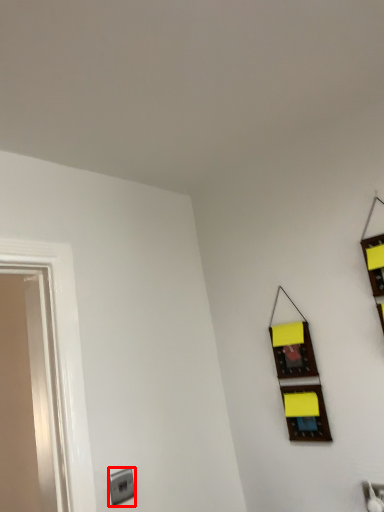
Question: From the image's perspective, what is the correct spatial relationship of electric outlet (annotated by the red box) in relation to window?

Choices:
 (A) below
 (B) above

Answer: (A)